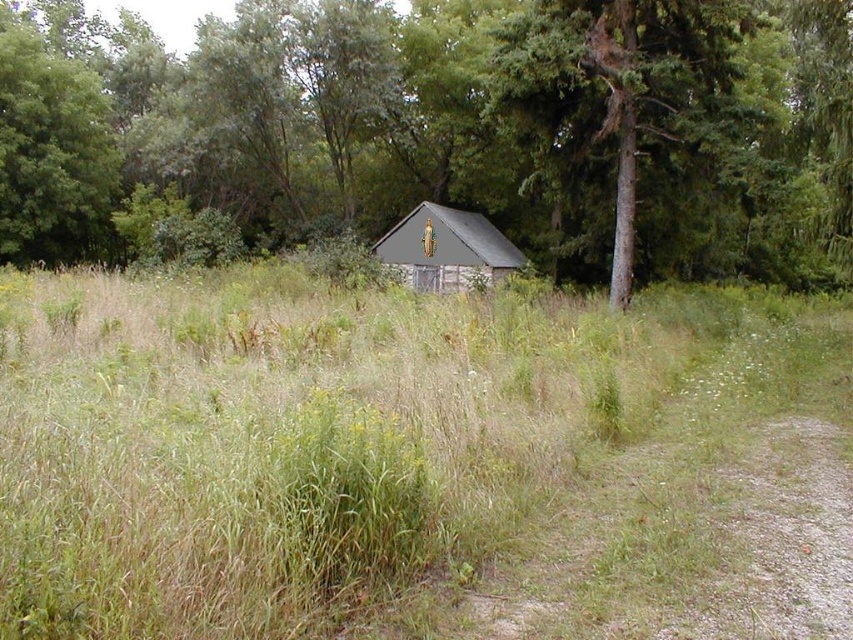
You are a hiker carrying a 10 meter long rope. You want to tie the green grassy at center to the brown wood tree at center. Is the rope long enough?

The distance between the green grassy at center and the brown wood tree at center is 13.06 meters. Since the rope is only 10 meters long, it is not long enough to reach between them.

You are standing in the rural scene and want to know which area takes up more space between the green grassy at center and the brown wood tree at center. Which one is larger?

The brown wood tree at center occupies more space than the green grassy at center, so the brown wood tree at center is larger.